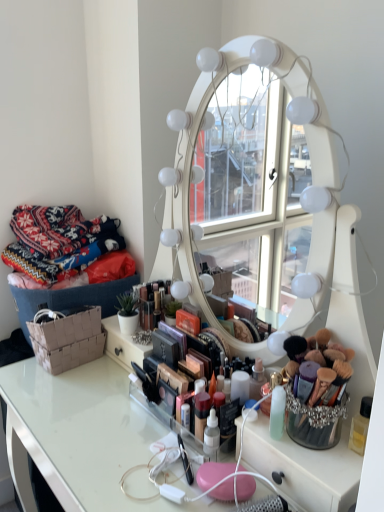
Identify the location of knitted fabric at left. (58, 241).

Describe the element at coordinates (68, 340) in the screenshot. I see `brown woven basket at lower left` at that location.

Describe the element at coordinates (79, 434) in the screenshot. This screenshot has width=384, height=512. I see `clear acrylic table at center` at that location.

The width and height of the screenshot is (384, 512). Identify the location of knitted fabric at left. (58, 241).

Is brown woven basket at lower left situated inside knitted fabric at left or outside?

brown woven basket at lower left is not enclosed by knitted fabric at left.

Which of these two, brown woven basket at lower left or knitted fabric at left, is wider?

Wider between the two is knitted fabric at left.

Considering the positions of objects brown woven basket at lower left and knitted fabric at left in the image provided, who is more to the left, brown woven basket at lower left or knitted fabric at left?

knitted fabric at left is more to the left.

Is brown woven basket at lower left directly adjacent to knitted fabric at left?

brown woven basket at lower left and knitted fabric at left are not in contact.

Considering the sizes of objects clear acrylic table at center and brown woven basket at lower left in the image provided, who is bigger, clear acrylic table at center or brown woven basket at lower left?

clear acrylic table at center.

Which object is further away from the camera taking this photo, clear acrylic table at center or brown woven basket at lower left?

Positioned behind is brown woven basket at lower left.

Looking at this image, considering the sizes of objects clear acrylic table at center and brown woven basket at lower left in the image provided, who is taller, clear acrylic table at center or brown woven basket at lower left?

With more height is clear acrylic table at center.

From the image's perspective, is clear acrylic table at center over brown woven basket at lower left?

Incorrect, from the image's perspective, clear acrylic table at center is lower than brown woven basket at lower left.

Considering the relative positions of knitted fabric at left and brown woven basket at lower left in the image provided, is knitted fabric at left to the left or to the right of brown woven basket at lower left?

knitted fabric at left is positioned on brown woven basket at lower left's left side.

From a real-world perspective, who is located higher, knitted fabric at left or brown woven basket at lower left?

From a 3D spatial view, knitted fabric at left is above.

Based on their sizes in the image, would you say knitted fabric at left is bigger or smaller than brown woven basket at lower left?

Considering their sizes, knitted fabric at left takes up more space than brown woven basket at lower left.

Would you say brown woven basket at lower left is part of knitted fabric at left's contents?

No, knitted fabric at left does not contain brown woven basket at lower left.

Which is more to the left, knitted fabric at left or clear acrylic table at center?

knitted fabric at left is more to the left.

From the image's perspective, which is below, knitted fabric at left or clear acrylic table at center?

clear acrylic table at center.

Identify the location of material on the left of clear acrylic table at center. The image size is (384, 512). (58, 241).

Considering the relative sizes of clear acrylic table at center and knitted fabric at left in the image provided, is clear acrylic table at center taller than knitted fabric at left?

Yes.

Is clear acrylic table at center turned away from knitted fabric at left?

clear acrylic table at center does not have its back to knitted fabric at left.

Is clear acrylic table at center wider than knitted fabric at left?

Yes, clear acrylic table at center is wider than knitted fabric at left.

How far apart are clear acrylic table at center and knitted fabric at left?

17.25 inches.

Is brown woven basket at lower left closer to the viewer compared to clear acrylic table at center?

No, it is not.

Does brown woven basket at lower left turn towards clear acrylic table at center?

No, brown woven basket at lower left does not turn towards clear acrylic table at center.

Considering the relative sizes of brown woven basket at lower left and clear acrylic table at center in the image provided, is brown woven basket at lower left smaller than clear acrylic table at center?

Correct, brown woven basket at lower left occupies less space than clear acrylic table at center.

I want to click on basket to the left of clear acrylic table at center, so click(x=68, y=340).

You are a GUI agent. You are given a task and a screenshot of the screen. Output one action in this format:
    pyautogui.click(x=<x>, y=<y>)
    Task: Click on the material above the brown woven basket at lower left (from the image's perspective)
    The image size is (384, 512).
    Given the screenshot: What is the action you would take?
    pyautogui.click(x=58, y=241)

In order to click on basket above the clear acrylic table at center (from a real-world perspective) in this screenshot , I will do `click(68, 340)`.

Looking at the image, which one is located further to clear acrylic table at center, brown woven basket at lower left or knitted fabric at left?

Among the two, knitted fabric at left is located further to clear acrylic table at center.

In the scene shown: Estimate the real-world distances between objects in this image. Which object is further from knitted fabric at left, brown woven basket at lower left or clear acrylic table at center?

Among the two, clear acrylic table at center is located further to knitted fabric at left.

Which object lies further to the anchor point knitted fabric at left, clear acrylic table at center or brown woven basket at lower left?

Based on the image, clear acrylic table at center appears to be further to knitted fabric at left.

Based on their spatial positions, is knitted fabric at left or brown woven basket at lower left further from clear acrylic table at center?

knitted fabric at left lies further to clear acrylic table at center than the other object.

Which object lies nearer to the anchor point brown woven basket at lower left, clear acrylic table at center or knitted fabric at left?

Among the two, clear acrylic table at center is located nearer to brown woven basket at lower left.

From the image, which object appears to be farther from brown woven basket at lower left, knitted fabric at left or clear acrylic table at center?

knitted fabric at left is positioned further to the anchor brown woven basket at lower left.

You are a GUI agent. You are given a task and a screenshot of the screen. Output one action in this format:
    pyautogui.click(x=<x>, y=<y>)
    Task: Click on the basket between knitted fabric at left and clear acrylic table at center from top to bottom
    
    Given the screenshot: What is the action you would take?
    pyautogui.click(x=68, y=340)